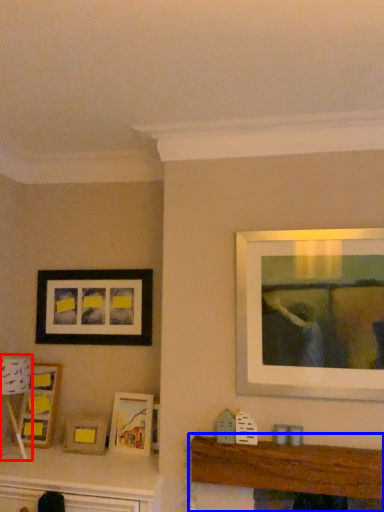
Question: Among these objects, which one is farthest to the camera, lamp (highlighted by a red box) or table (highlighted by a blue box)?

Choices:
 (A) lamp
 (B) table

Answer: (A)